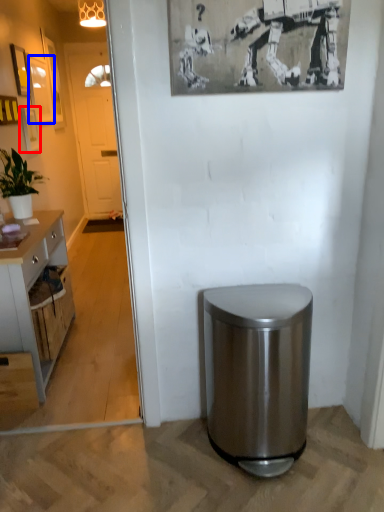
Question: Among these objects, which one is nearest to the camera, picture frame (highlighted by a red box) or picture frame (highlighted by a blue box)?

Choices:
 (A) picture frame
 (B) picture frame

Answer: (A)